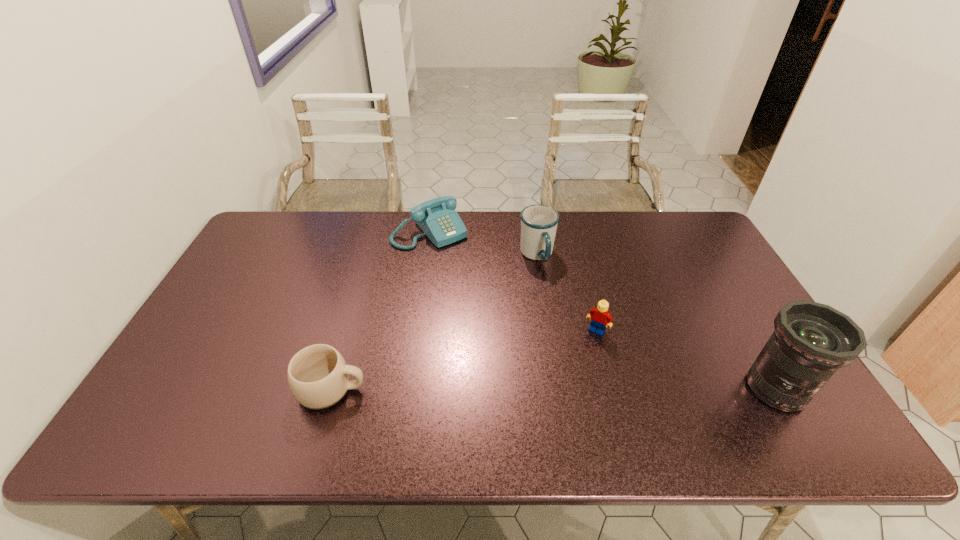
The height and width of the screenshot is (540, 960). I want to click on free space on the desktop that is between the left mug and the telephoto lens and is positioned on the front-facing side of the third farthest object, so click(x=562, y=389).

Image resolution: width=960 pixels, height=540 pixels. Find the location of `free space on the desktop that is between the shorter mug and the telephoto lens and is positioned on the handle side of the farther mug`. free space on the desktop that is between the shorter mug and the telephoto lens and is positioned on the handle side of the farther mug is located at coordinates (618, 389).

Find the location of a particular element. This screenshot has height=540, width=960. vacant spot on the desktop that is between the shorter mug and the rightmost object and is positioned on the dial of the telephone is located at coordinates (578, 389).